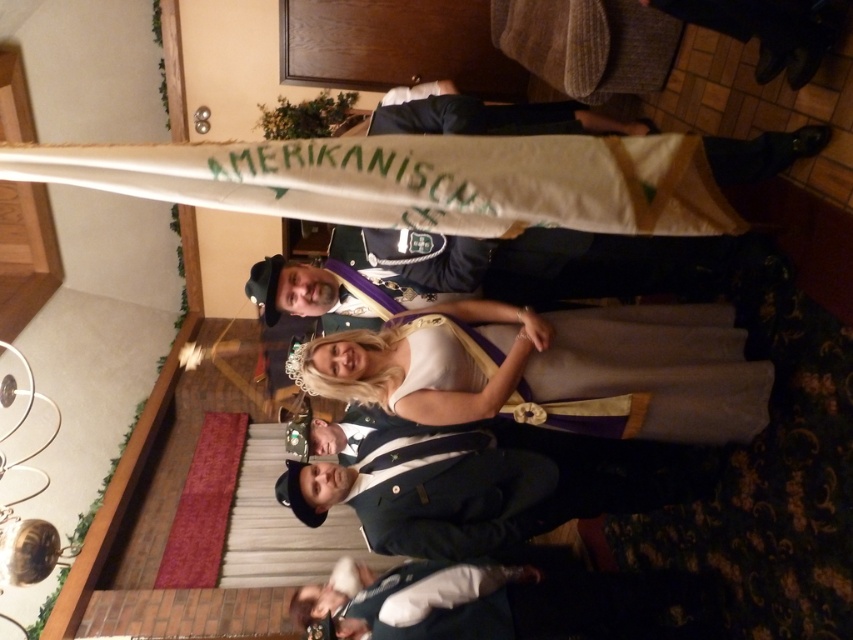
Question: Based on their relative distances, which object is nearer to the shiny gold chain at center?

Choices:
 (A) white satin dress at center
 (B) dark blue suit at center

Answer: (A)

Question: Can you confirm if white satin dress at center is positioned to the right of dark blue suit at center?

Choices:
 (A) no
 (B) yes

Answer: (B)

Question: Among these objects, which one is farthest from the camera?

Choices:
 (A) shiny gold chain at center
 (B) white satin dress at center
 (C) dark blue suit at center

Answer: (C)

Question: In this image, where is white satin dress at center located relative to dark blue suit at center?

Choices:
 (A) above
 (B) below

Answer: (A)

Question: Is white satin dress at center below shiny gold chain at center?

Choices:
 (A) yes
 (B) no

Answer: (A)

Question: Among these points, which one is farthest from the camera?

Choices:
 (A) (432, 353)
 (B) (296, 481)

Answer: (B)